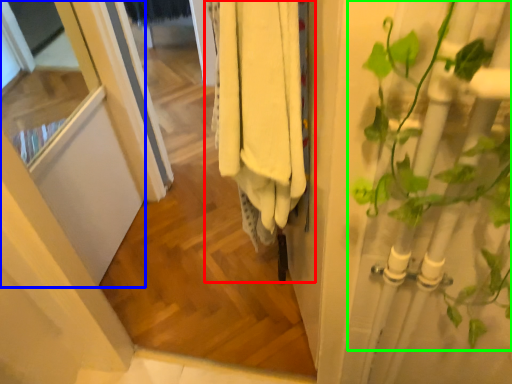
Question: Based on their relative distances, which object is farther from closet (highlighted by a red box)? Choose from screen door (highlighted by a blue box) and houseplant (highlighted by a green box).

Choices:
 (A) screen door
 (B) houseplant

Answer: (A)